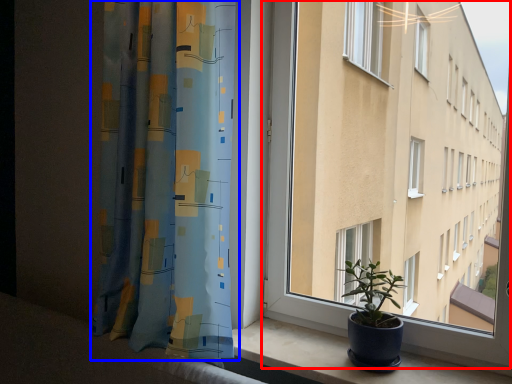
Question: Which object appears farthest to the camera in this image, window (highlighted by a red box) or curtain (highlighted by a blue box)?

Choices:
 (A) window
 (B) curtain

Answer: (B)